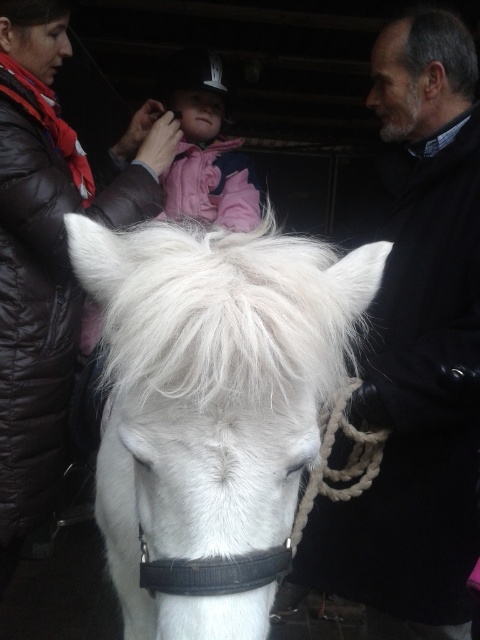
You are standing in front of the image and want to determine which of the two points, point [194,435] or point [197,106], is closer to you. Based on the description, which point is nearer?

Point [194,435] is closer to the viewer than point [197,106].

You are a photographer trying to capture a clear photo of the white fluffy horse at center and the pink fleece jacket at center. Which one should you focus on first to ensure it appears sharp in the foreground?

The white fluffy horse at center is in front of the pink fleece jacket at center, so you should focus on the white fluffy horse at center first to ensure it appears sharp in the foreground.